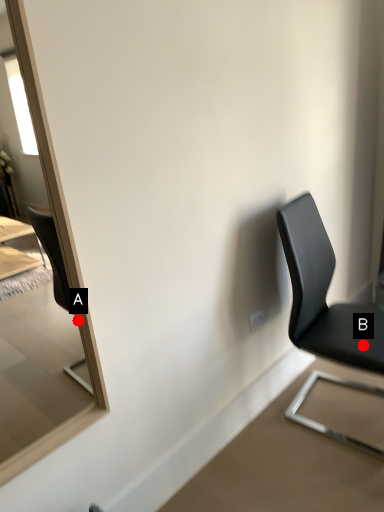
Question: Two points are circled on the image, labeled by A and B beside each circle. Which point is closer to the camera taking this photo?

Choices:
 (A) A is closer
 (B) B is closer

Answer: (A)